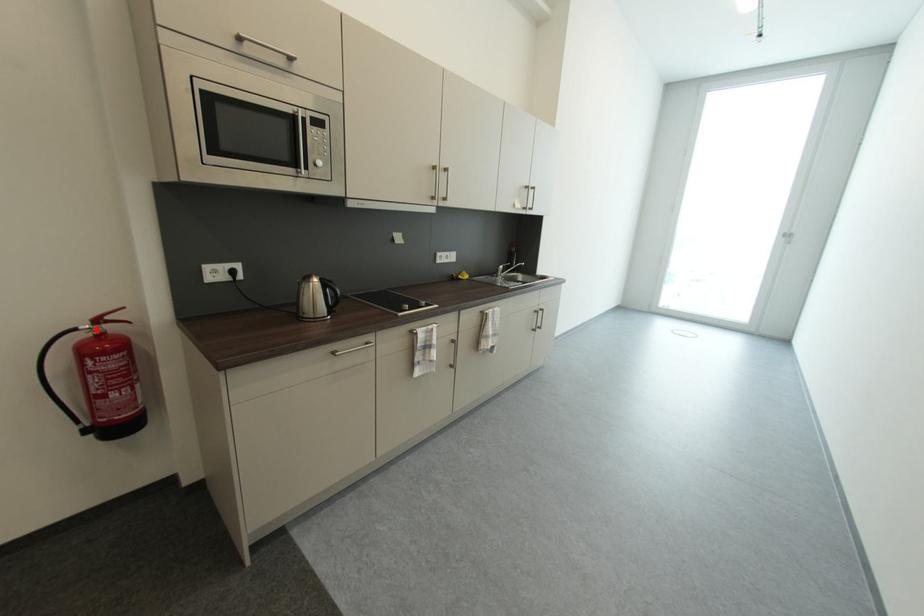
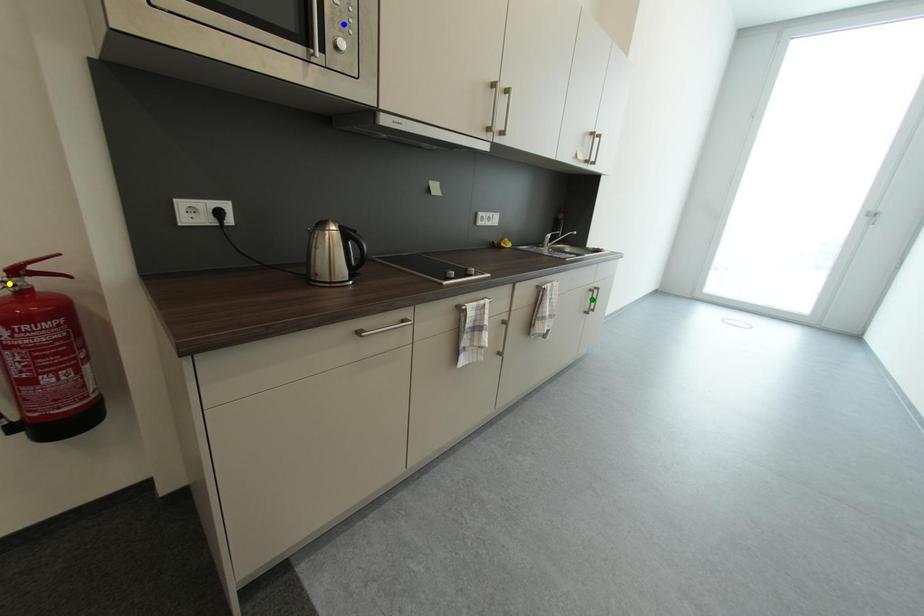
Question: I am providing you with two images of the same scene from different viewpoints. A red point is marked on the first image. You are given multiple points on the second image. Which point in image 2 represents the same 3d spot as the red point in image 1?

Choices:
 (A) blue point
 (B) yellow point
 (C) green point

Answer: (B)